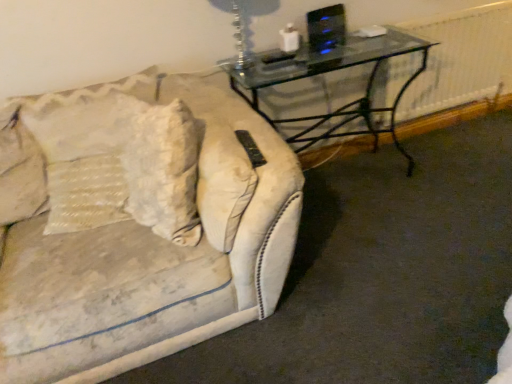
Question: Is white textured radiator at right facing away from transparent glass table at upper right?

Choices:
 (A) no
 (B) yes

Answer: (A)

Question: Would you say white textured radiator at right is a long distance from transparent glass table at upper right?

Choices:
 (A) no
 (B) yes

Answer: (A)

Question: From a real-world perspective, is white textured radiator at right over transparent glass table at upper right?

Choices:
 (A) yes
 (B) no

Answer: (A)

Question: Does white textured radiator at right have a smaller size compared to transparent glass table at upper right?

Choices:
 (A) yes
 (B) no

Answer: (A)

Question: Is transparent glass table at upper right a part of white textured radiator at right?

Choices:
 (A) no
 (B) yes

Answer: (A)

Question: In the image, is clear glass table lamp at upper center positioned in front of or behind transparent glass table at upper right?

Choices:
 (A) behind
 (B) front

Answer: (B)

Question: From the image's perspective, is clear glass table lamp at upper center located above or below transparent glass table at upper right?

Choices:
 (A) below
 (B) above

Answer: (B)

Question: Is clear glass table lamp at upper center taller or shorter than transparent glass table at upper right?

Choices:
 (A) short
 (B) tall

Answer: (A)

Question: Is clear glass table lamp at upper center inside the boundaries of transparent glass table at upper right, or outside?

Choices:
 (A) inside
 (B) outside

Answer: (B)

Question: Is white textured pillow at left taller or shorter than transparent glass table at upper right?

Choices:
 (A) short
 (B) tall

Answer: (A)

Question: Does point (6, 180) appear closer or farther from the camera than point (250, 62)?

Choices:
 (A) farther
 (B) closer

Answer: (B)

Question: In the image, is white textured pillow at left positioned in front of or behind transparent glass table at upper right?

Choices:
 (A) front
 (B) behind

Answer: (A)

Question: From a real-world perspective, is white textured pillow at left above or below transparent glass table at upper right?

Choices:
 (A) above
 (B) below

Answer: (A)

Question: Based on their sizes in the image, would you say clear glass table lamp at upper center is bigger or smaller than white textured radiator at right?

Choices:
 (A) small
 (B) big

Answer: (A)

Question: In terms of height, does clear glass table lamp at upper center look taller or shorter compared to white textured radiator at right?

Choices:
 (A) tall
 (B) short

Answer: (B)